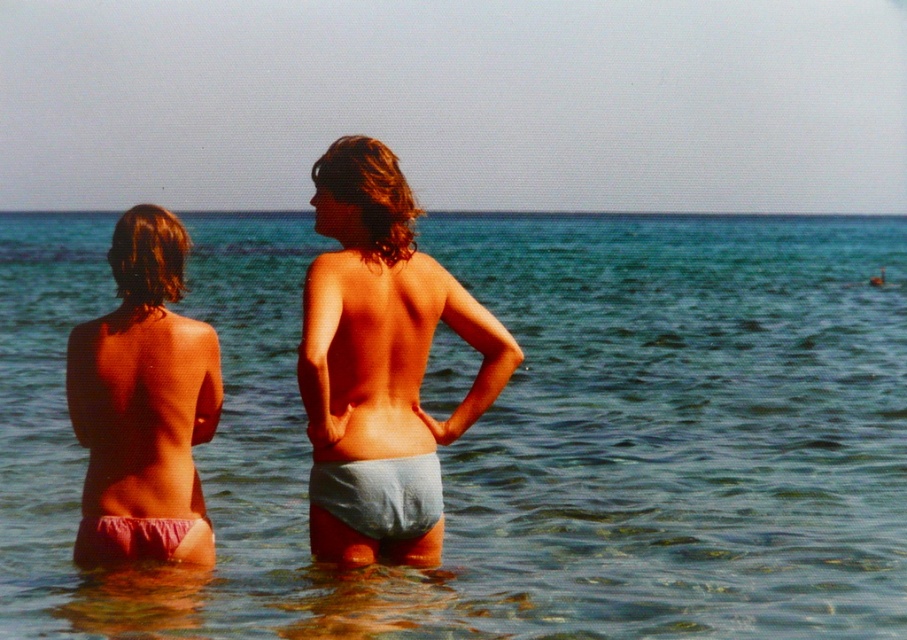
You are a photographer trying to capture the perfect shot of the two people at the beach. You notice the pink fabric bikini bottom at left and the pink fabric bikini at lower left in the scene. Which one is positioned more to the right side?

The pink fabric bikini bottom at left is positioned more to the right side than the pink fabric bikini at lower left.

You are standing on the beach and want to walk towards the clear blue water at center. According to the coordinates provided, in which direction should you move relative to your current position?

The clear blue water at center is located at coordinates point (511, 435). Therefore, you should move towards the direction of the coordinates to reach it.

You are a photographer trying to capture a photo of the light blue fabric shorts at center and the pink fabric bikini at lower left. Which object should you focus on first if you want to include both in your frame without moving the camera?

You should focus on the pink fabric bikini at lower left first because it is closer to the camera than the light blue fabric shorts at center, which is further away.